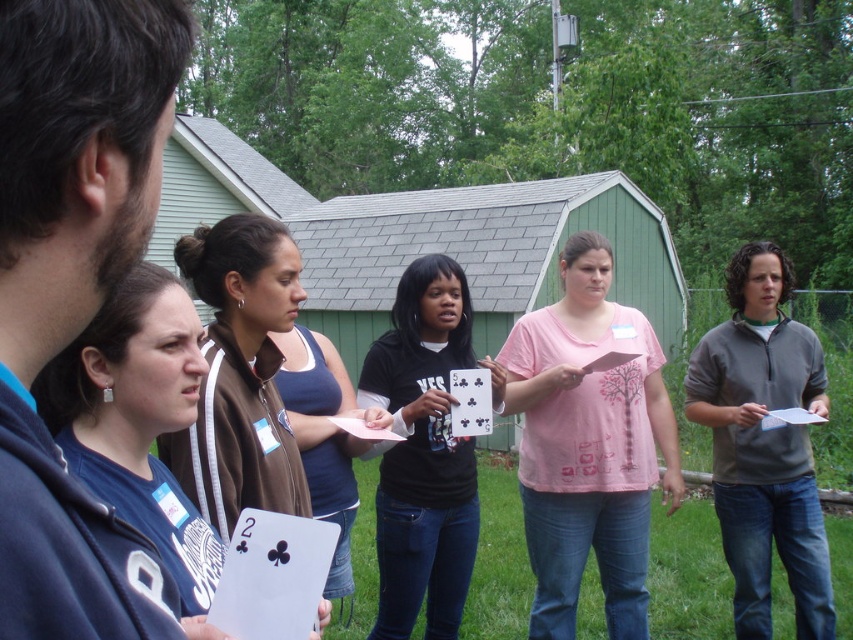
Question: Considering the relative positions of blue fabric shirt at center and black paper card at center in the image provided, where is blue fabric shirt at center located with respect to black paper card at center?

Choices:
 (A) left
 (B) right

Answer: (A)

Question: Which object is the farthest from the black paper card at center?

Choices:
 (A) blue fabric shirt at center
 (B) pink paper at center
 (C) black paper card at lower left

Answer: (C)

Question: Considering the relative positions of black matte shirt at center and white paper at right in the image provided, where is black matte shirt at center located with respect to white paper at right?

Choices:
 (A) right
 (B) left

Answer: (B)

Question: Which point is farther from the camera taking this photo?

Choices:
 (A) (483, 404)
 (B) (384, 435)
 (C) (579, 289)

Answer: (C)

Question: Considering the real-world distances, which object is farthest from the black matte shirt at center?

Choices:
 (A) pink paper at center
 (B) pink fabric shirt at center

Answer: (A)

Question: Can you confirm if gray fleece sweater at center is smaller than white paper at right?

Choices:
 (A) yes
 (B) no

Answer: (B)